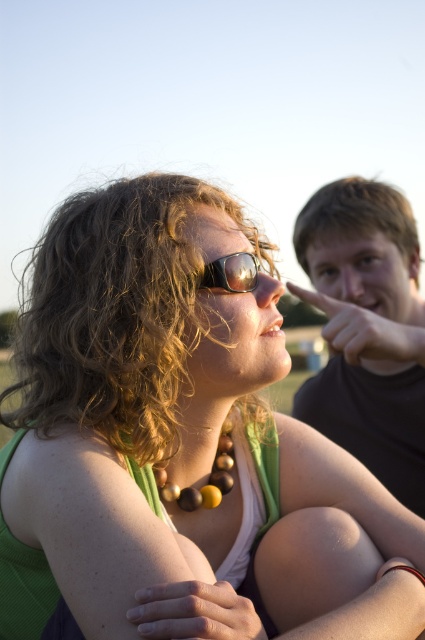
Between dark brown hair at upper right and sunglasses at center, which one is positioned lower?

dark brown hair at upper right

Can you confirm if dark brown hair at upper right is wider than sunglasses at center?

Yes, dark brown hair at upper right is wider than sunglasses at center.

This screenshot has height=640, width=425. In order to click on dark brown hair at upper right in this screenshot , I will do click(367, 330).

This screenshot has width=425, height=640. What are the coordinates of `dark brown hair at upper right` in the screenshot? It's located at (367, 330).

Can you confirm if green matte necklace at upper center is smaller than dark brown hair at upper right?

No.

Image resolution: width=425 pixels, height=640 pixels. What do you see at coordinates (180, 444) in the screenshot?
I see `green matte necklace at upper center` at bounding box center [180, 444].

Where is `green matte necklace at upper center`? This screenshot has height=640, width=425. green matte necklace at upper center is located at coordinates (180, 444).

Does green matte necklace at upper center have a greater height compared to sunglasses at center?

Yes.

Is point (129, 419) farther from viewer compared to point (229, 291)?

No, it is in front of (229, 291).

I want to click on green matte necklace at upper center, so click(180, 444).